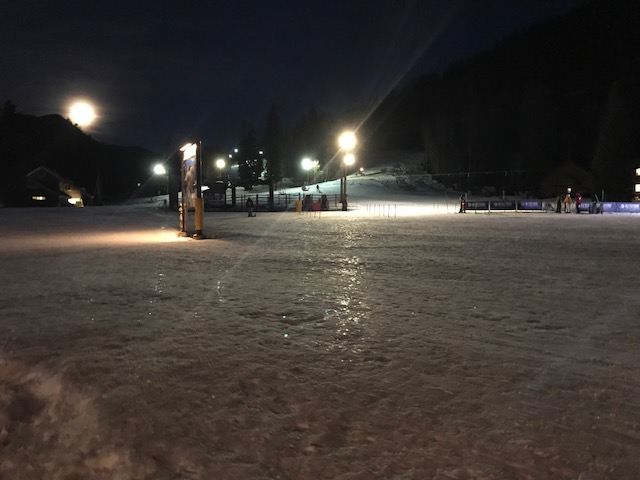
At what (x,y) coordinates should I click in order to perform the action: click on lights. Please return your answer as a coordinate pair (x, y). The height and width of the screenshot is (480, 640). Looking at the image, I should click on (157, 168), (221, 164), (307, 164), (347, 144), (346, 160).